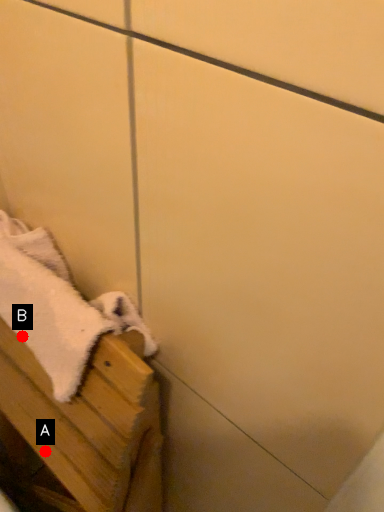
Question: Two points are circled on the image, labeled by A and B beside each circle. Among these points, which one is farthest from the camera?

Choices:
 (A) A is further
 (B) B is further

Answer: (A)